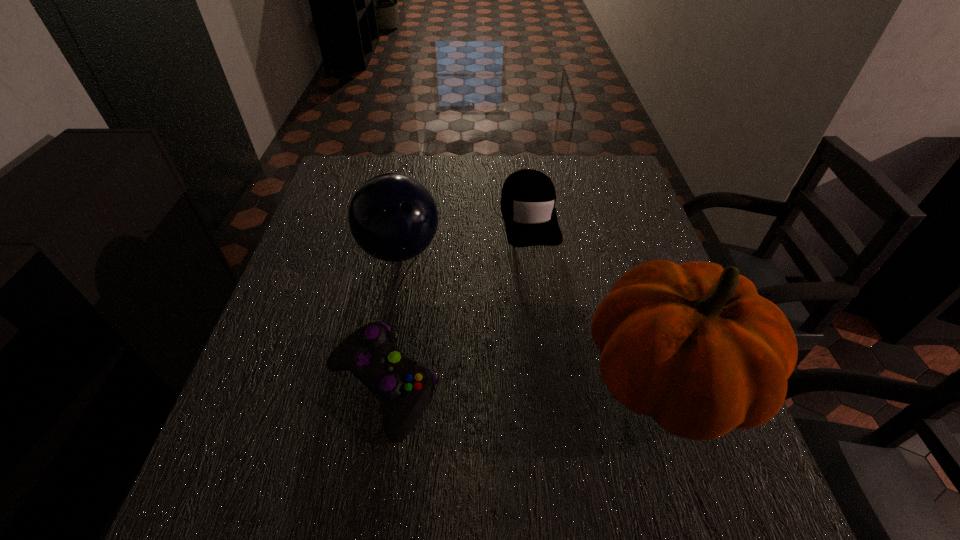
You are a GUI agent. You are given a task and a screenshot of the screen. Output one action in this format:
    pyautogui.click(x=<x>, y=<y>)
    Task: Click on the empty space that is in between the pumpkin and the shortest object
    
    Given the screenshot: What is the action you would take?
    pyautogui.click(x=525, y=383)

The image size is (960, 540). Find the location of `vacant space in between the second tallest object and the second shortest object`. vacant space in between the second tallest object and the second shortest object is located at coordinates tap(465, 234).

At what (x,y) coordinates should I click in order to perform the action: click on free space between the cap and the control. Please return your answer as a coordinate pair (x, y). This screenshot has height=540, width=960. Looking at the image, I should click on (455, 302).

At what (x,y) coordinates should I click in order to perform the action: click on vacant area between the third tallest object and the pumpkin. Please return your answer as a coordinate pair (x, y). Looking at the image, I should click on (599, 298).

In order to click on vacant space that is in between the third tallest object and the pumpkin in this screenshot , I will do `click(599, 298)`.

The height and width of the screenshot is (540, 960). In order to click on vacant region between the shortest object and the tallest object in this screenshot , I will do `click(525, 383)`.

At what (x,y) coordinates should I click in order to perform the action: click on object that stands as the third closest to the cap. Please return your answer as a coordinate pair (x, y). Looking at the image, I should click on (404, 387).

The image size is (960, 540). Find the location of `object that stands as the second closest to the pumpkin`. object that stands as the second closest to the pumpkin is located at coordinates 404,387.

Identify the location of free point that satisfies the following two spatial constraints: 1. on the front side of the second tallest object; 2. on the left side of the pumpkin. This screenshot has height=540, width=960. (376, 379).

Where is `vacant space that satisfies the following two spatial constraints: 1. on the front side of the bowling ball; 2. on the right side of the control`? This screenshot has width=960, height=540. vacant space that satisfies the following two spatial constraints: 1. on the front side of the bowling ball; 2. on the right side of the control is located at coordinates (374, 388).